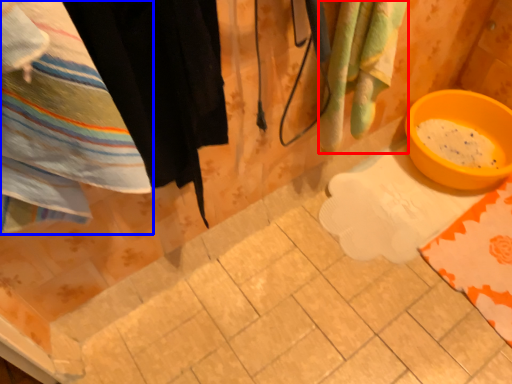
Question: Among these objects, which one is nearest to the camera, beach towel (highlighted by a red box) or towel (highlighted by a blue box)?

Choices:
 (A) beach towel
 (B) towel

Answer: (B)